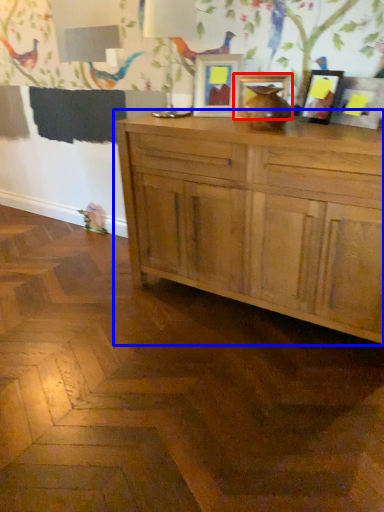
Question: Which object is further to the camera taking this photo, picture frame (highlighted by a red box) or cabinetry (highlighted by a blue box)?

Choices:
 (A) picture frame
 (B) cabinetry

Answer: (A)